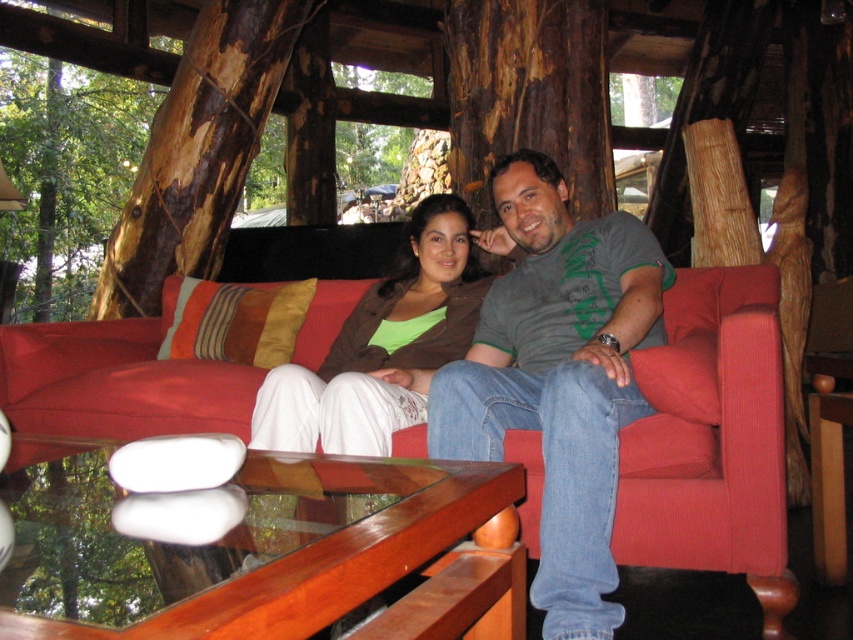
Is gray-green t-shirt at center above brown rough wood at left?

No, gray-green t-shirt at center is not above brown rough wood at left.

Is gray-green t-shirt at center to the right of brown rough wood at left from the viewer's perspective?

Correct, you'll find gray-green t-shirt at center to the right of brown rough wood at left.

Does point (560, 580) lie behind point (157, 214)?

No, it is not.

You are a GUI agent. You are given a task and a screenshot of the screen. Output one action in this format:
    pyautogui.click(x=<x>, y=<y>)
    Task: Click on the gray-green t-shirt at center
    This screenshot has height=640, width=853.
    Given the screenshot: What is the action you would take?
    pyautogui.click(x=558, y=378)

Is point (785, 531) positioned behind point (550, 465)?

Yes, it is behind point (550, 465).

Who is taller, corduroy red couch at center or gray-green t-shirt at center?

Standing taller between the two is gray-green t-shirt at center.

Identify the location of corduroy red couch at center. (711, 436).

In the scene shown: Is gray-green t-shirt at center bigger than matte brown jacket at center?

Correct, gray-green t-shirt at center is larger in size than matte brown jacket at center.

Who is more distant from viewer, (468, 435) or (421, 340)?

Positioned behind is point (421, 340).

Which is in front, point (642, 397) or point (289, 369)?

Point (642, 397) is in front.

Where is `gray-green t-shirt at center`? The height and width of the screenshot is (640, 853). gray-green t-shirt at center is located at coordinates (558, 378).